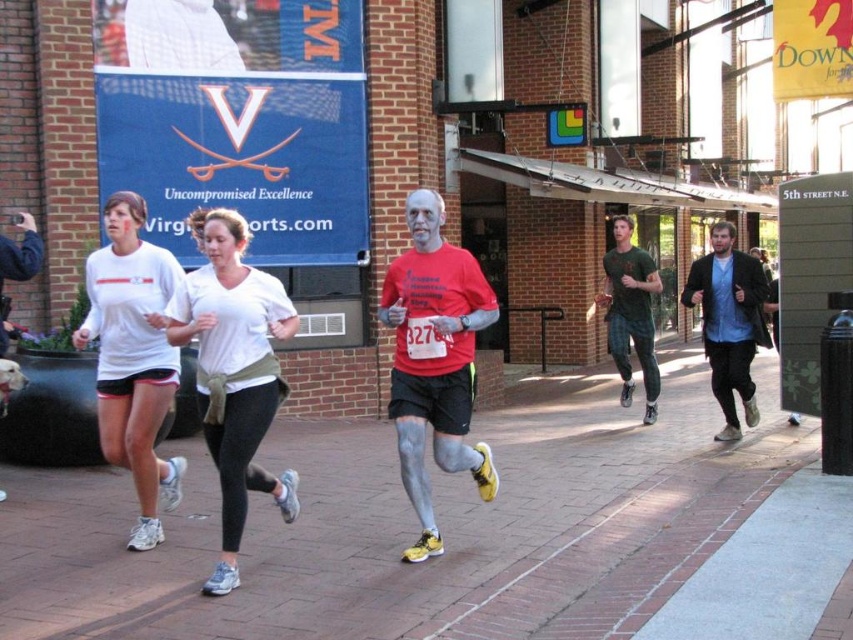
Question: Among these objects, which one is nearest to the camera?

Choices:
 (A) green matte t-shirt at center
 (B) white matte t-shirt at center

Answer: (B)

Question: Which point is farther to the camera?

Choices:
 (A) white matte t-shirt at left
 (B) brick pavement at center
 (C) white matte t-shirt at center
 (D) matte red shirt at center

Answer: (B)

Question: Is white matte t-shirt at center to the right of matte red shirt at center from the viewer's perspective?

Choices:
 (A) no
 (B) yes

Answer: (A)

Question: Is blue cotton shirt at right in front of green matte t-shirt at center?

Choices:
 (A) yes
 (B) no

Answer: (A)

Question: In this image, where is white matte t-shirt at center located relative to green matte t-shirt at center?

Choices:
 (A) left
 (B) right

Answer: (A)

Question: Which object is positioned closest to the green matte t-shirt at center?

Choices:
 (A) brick pavement at center
 (B) matte red shirt at center
 (C) white matte t-shirt at left

Answer: (B)